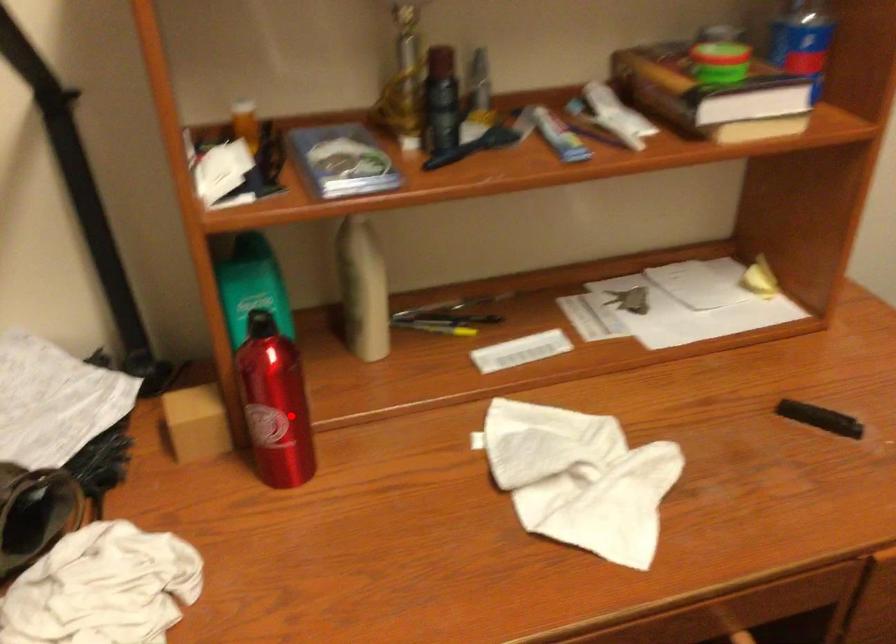
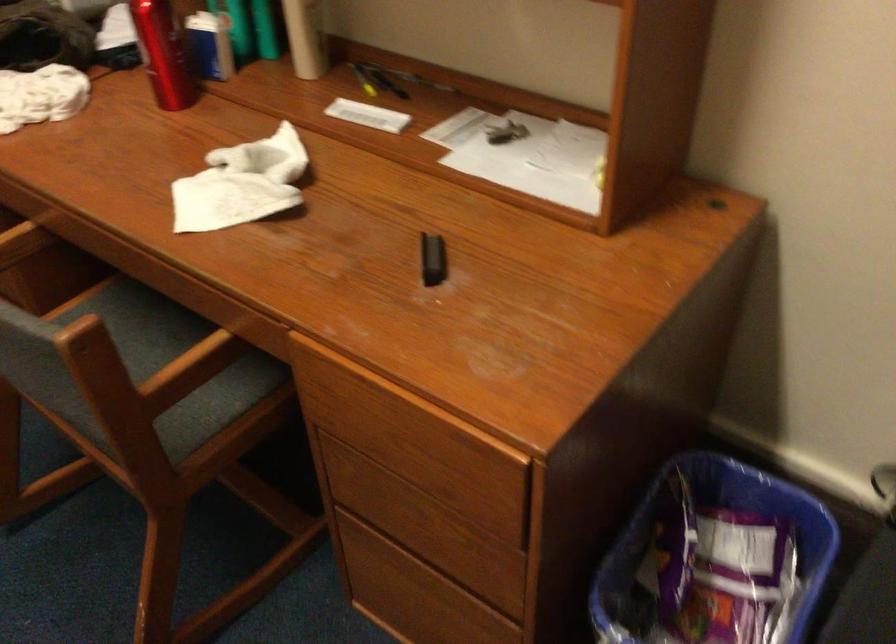
In the second image, find the point that corresponds to the highlighted location in the first image.

(162, 53)